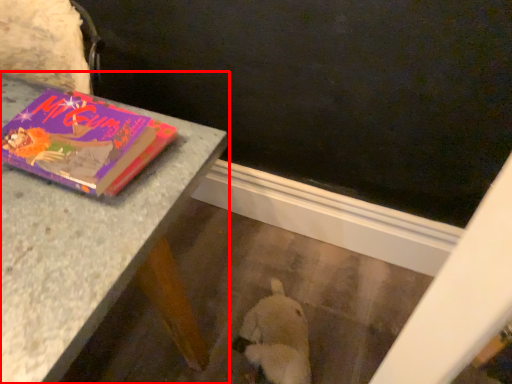
Question: Considering the relative positions of table (annotated by the red box) and book in the image provided, where is table (annotated by the red box) located with respect to the staircase?

Choices:
 (A) left
 (B) right

Answer: (A)